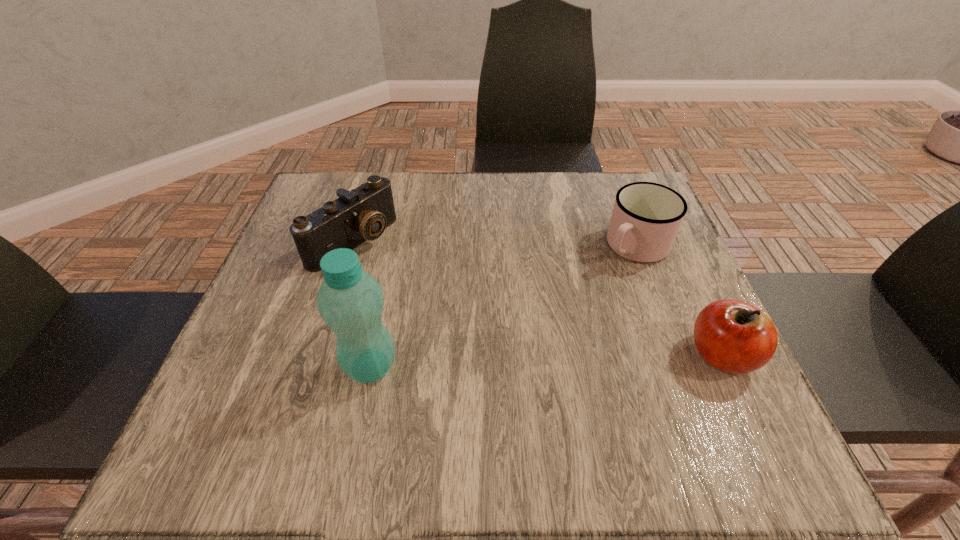
Locate an element on the screen. The height and width of the screenshot is (540, 960). vacant space that's between the bottle and the mug is located at coordinates (503, 306).

Image resolution: width=960 pixels, height=540 pixels. I want to click on vacant region between the mug and the apple, so click(679, 300).

Where is `free space between the tallest object and the mug`? free space between the tallest object and the mug is located at coordinates 503,306.

What are the coordinates of `empty space between the camera and the apple` in the screenshot? It's located at (537, 299).

Where is `empty location between the tallest object and the mug`? The height and width of the screenshot is (540, 960). empty location between the tallest object and the mug is located at coordinates (503, 306).

Locate an element on the screen. The image size is (960, 540). free space between the mug and the tallest object is located at coordinates (503, 306).

You are a GUI agent. You are given a task and a screenshot of the screen. Output one action in this format:
    pyautogui.click(x=<x>, y=<y>)
    Task: Click on the empty location between the mug and the camera
    
    Given the screenshot: What is the action you would take?
    pyautogui.click(x=493, y=244)

Locate which object ranks third in proximity to the mug. Please provide its 2D coordinates. Your answer should be formatted as a tuple, i.e. [(x, y)], where the tuple contains the x and y coordinates of a point satisfying the conditions above.

[(362, 214)]

Locate which object ranks in proximity to the camera. Please provide its 2D coordinates. Your answer should be formatted as a tuple, i.e. [(x, y)], where the tuple contains the x and y coordinates of a point satisfying the conditions above.

[(350, 301)]

Where is `free spot that satisfies the following two spatial constraints: 1. on the back side of the bottle; 2. on the right side of the mug`? free spot that satisfies the following two spatial constraints: 1. on the back side of the bottle; 2. on the right side of the mug is located at coordinates (396, 246).